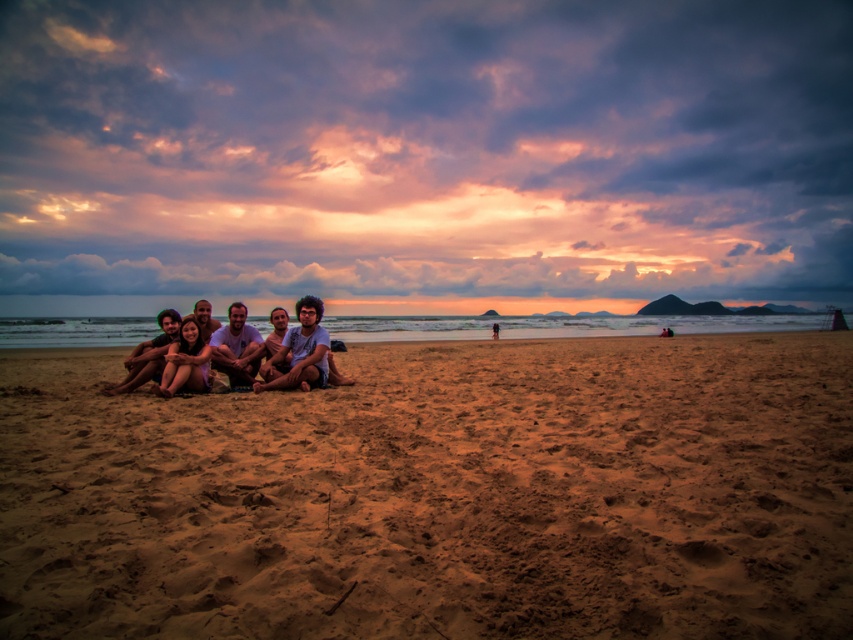
Question: Which is nearer to the matte black hair at center?

Choices:
 (A) brown sandy beach at center
 (B) smooth sand at center
 (C) curly-haired person at center
 (D) matte white shirt at center

Answer: (D)

Question: Does matte white shirt at center have a greater width compared to curly-haired person at center?

Choices:
 (A) yes
 (B) no

Answer: (A)

Question: Which point is farther to the camera?

Choices:
 (A) (221, 348)
 (B) (494, 330)
 (C) (141, 348)
 (D) (308, 310)

Answer: (B)

Question: Can you confirm if matte white shirt at center is smaller than smooth sand at center?

Choices:
 (A) yes
 (B) no

Answer: (A)

Question: Is matte black hair at center closer to the viewer compared to smooth sand at center?

Choices:
 (A) no
 (B) yes

Answer: (B)

Question: Which object appears farthest from the camera in this image?

Choices:
 (A) matte skin people at lower left
 (B) curly-haired person at center

Answer: (B)